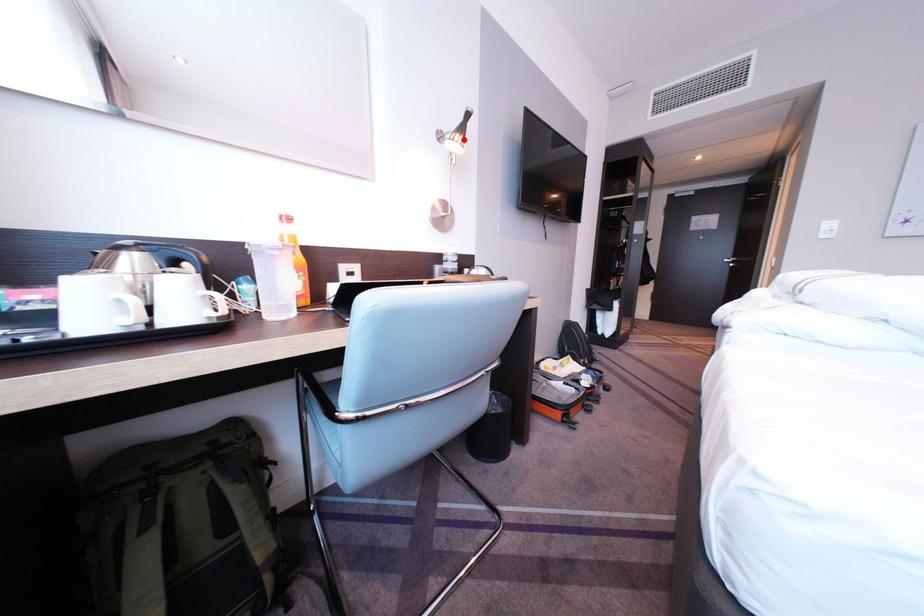
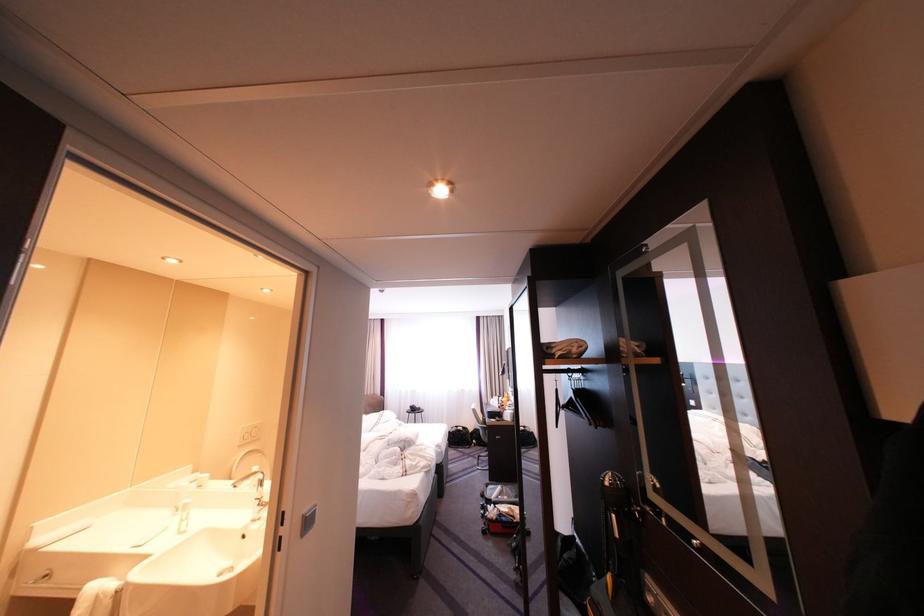
Question: I am providing you with two images of the same scene from different viewpoints. A red point is marked on the first image. Can you still see the location of the red point in image 2?

Choices:
 (A) Yes
 (B) No

Answer: (B)